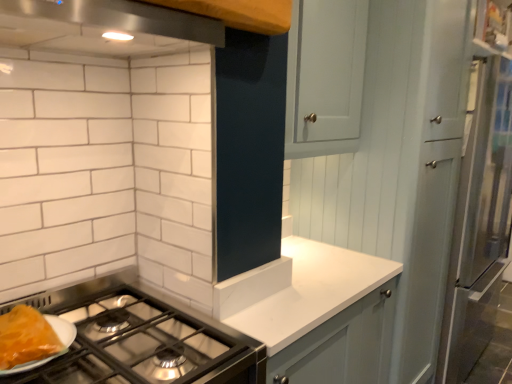
Image resolution: width=512 pixels, height=384 pixels. Find the location of `empty space that is ontop of white laminate countertop at center`. empty space that is ontop of white laminate countertop at center is located at coordinates (315, 275).